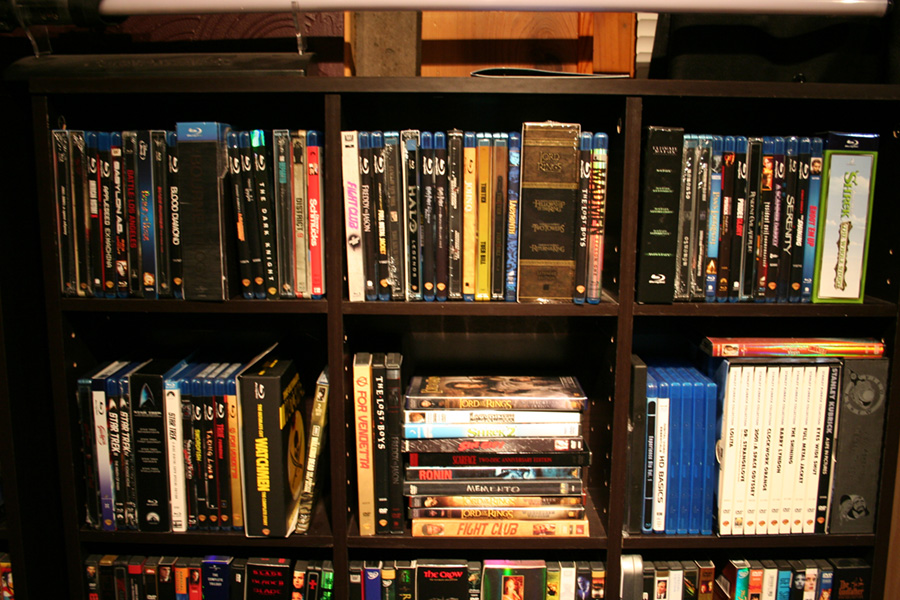
Identify the location of blue dvd cases. The width and height of the screenshot is (900, 600). (708, 457), (698, 457), (688, 461), (678, 466), (784, 587), (376, 583), (148, 215), (511, 232), (713, 213), (814, 224).